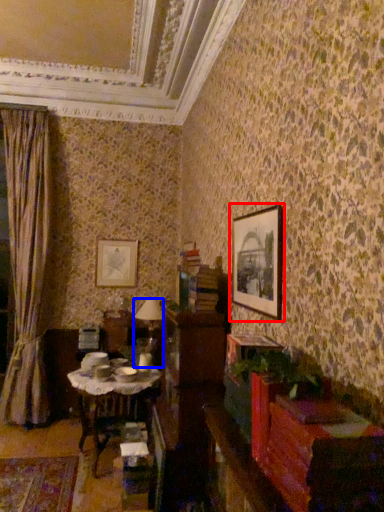
Question: Which point is further to the camera, picture frame (highlighted by a red box) or table lamp (highlighted by a blue box)?

Choices:
 (A) picture frame
 (B) table lamp

Answer: (B)